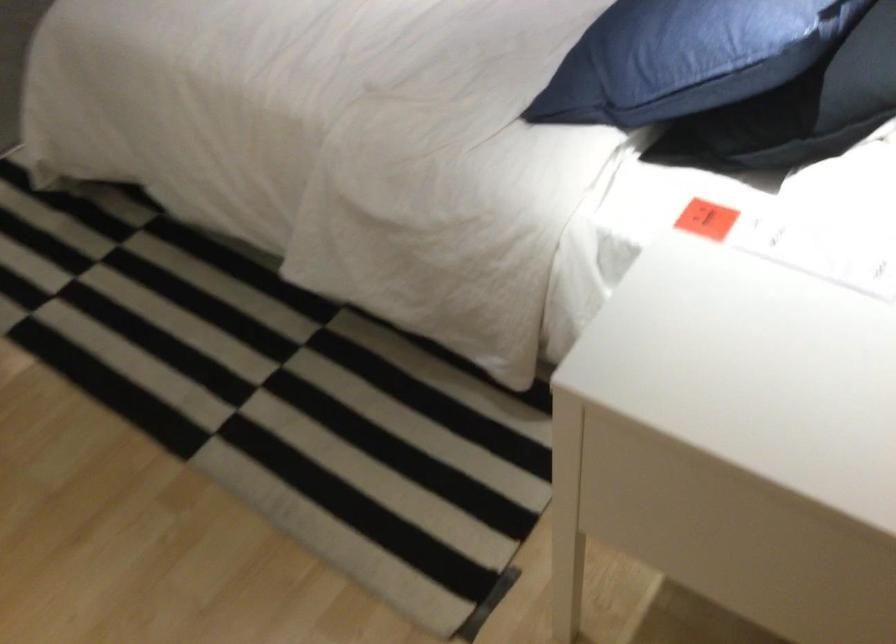
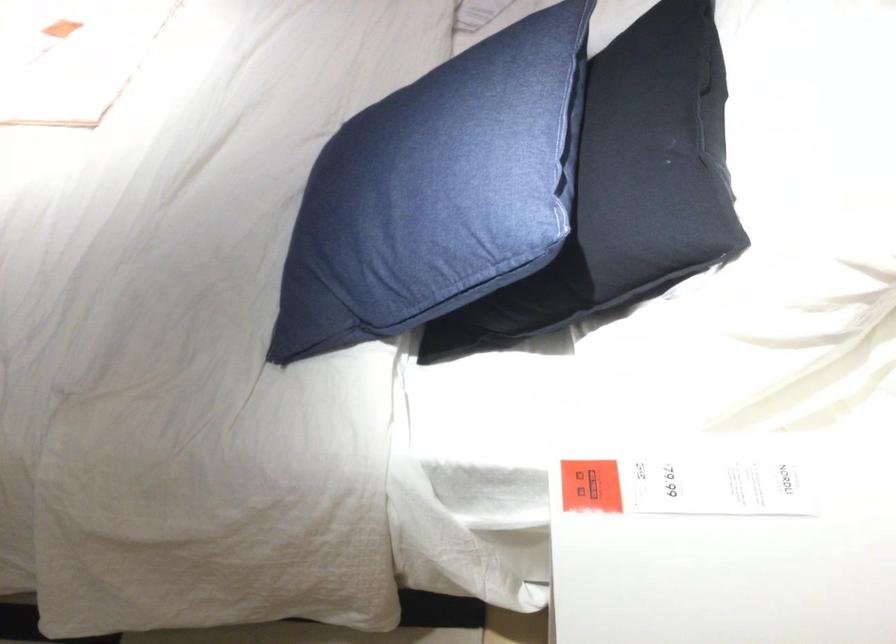
Question: The images are taken continuously from a first-person perspective. In which direction is your viewpoint rotating?

Choices:
 (A) Left
 (B) Right
 (C) Up
 (D) Down

Answer: (B)